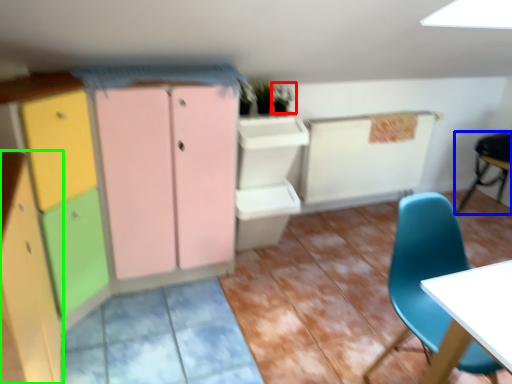
Question: Considering the real-world distances, which object is farthest from plant (highlighted by a red box)? chair (highlighted by a blue box) or cabinetry (highlighted by a green box)?

Choices:
 (A) chair
 (B) cabinetry

Answer: (A)